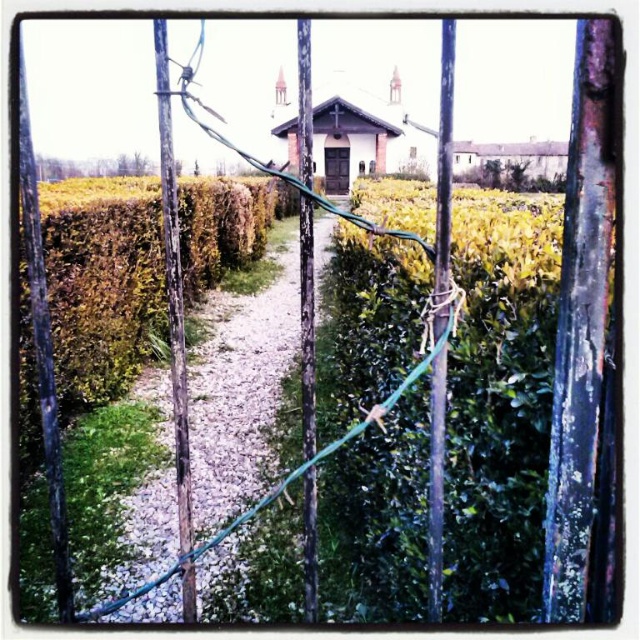
Question: Which of the following is the closest to the observer?

Choices:
 (A) click(x=237, y=440)
 (B) click(x=182, y=189)

Answer: (A)

Question: Which point is closer to the camera?

Choices:
 (A) (154, 321)
 (B) (262, 300)

Answer: (A)

Question: Does green leafy hedge at center appear on the left side of green gravel path at center?

Choices:
 (A) yes
 (B) no

Answer: (A)

Question: Which of the following is the farthest from the observer?

Choices:
 (A) (266, 193)
 (B) (218, 497)

Answer: (A)

Question: Does green leafy hedge at center appear under green gravel path at center?

Choices:
 (A) yes
 (B) no

Answer: (B)

Question: Is green leafy hedge at center smaller than green gravel path at center?

Choices:
 (A) no
 (B) yes

Answer: (A)